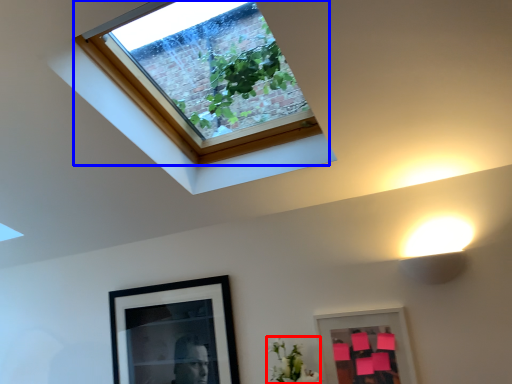
Question: Which of the following is the farthest to the observer, flower (highlighted by a red box) or window (highlighted by a blue box)?

Choices:
 (A) flower
 (B) window

Answer: (A)